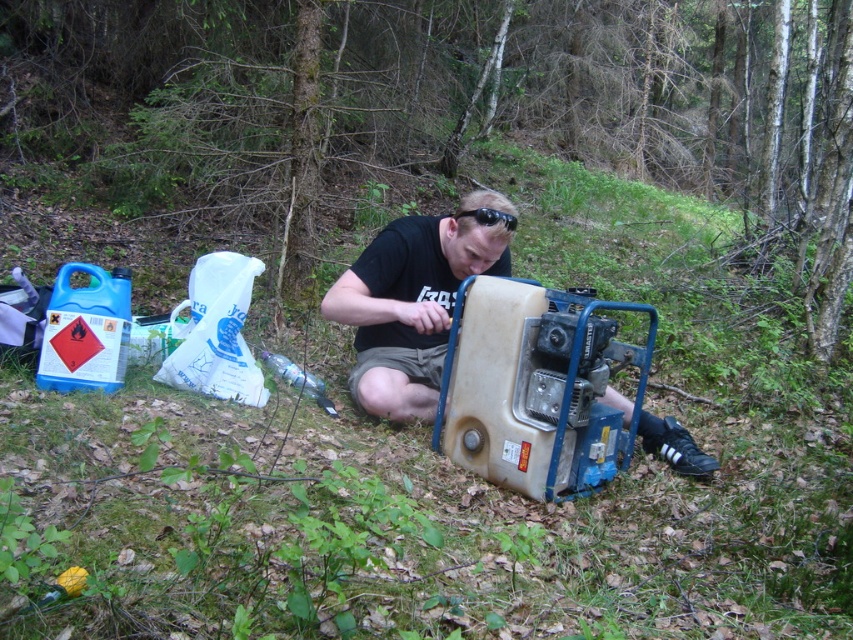
Question: Where is beige plastic generator at center located in relation to matte black generator at center in the image?

Choices:
 (A) above
 (B) below

Answer: (B)

Question: Is beige plastic generator at center closer to camera compared to matte black generator at center?

Choices:
 (A) yes
 (B) no

Answer: (A)

Question: Which point is farther from the camera taking this photo?

Choices:
 (A) (515, 420)
 (B) (428, 236)

Answer: (B)

Question: Is beige plastic generator at center thinner than matte black generator at center?

Choices:
 (A) yes
 (B) no

Answer: (B)

Question: Among these objects, which one is nearest to the camera?

Choices:
 (A) beige plastic generator at center
 (B) matte black generator at center

Answer: (A)